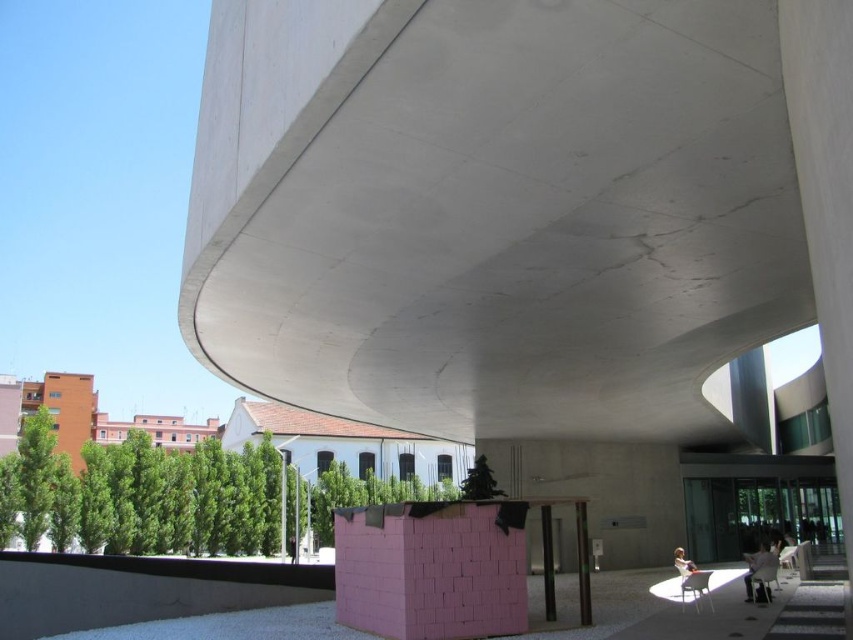
Based on the photo, you are standing at the entrance of the building and want to place a pink foam block at center. What are the coordinates where you should place it?

The pink foam block at center should be placed at coordinates point (431, 568).

You are standing in front of the curved concrete structure and want to determine which of the two points, point (514, 561) or point (554, 616), is closer to you. Based on the scene, which point should you choose?

Point (514, 561) is closer to the camera than point (554, 616), so you should choose point (514, 561) as it is nearer to your position.

You are an architect designing a new installation. You have two objects in your design plan, the pink foam block at center and the smooth concrete pillar at center. According to the image, which object is placed above the other?

The pink foam block at center is positioned over the smooth concrete pillar at center, meaning it is placed above the pillar.